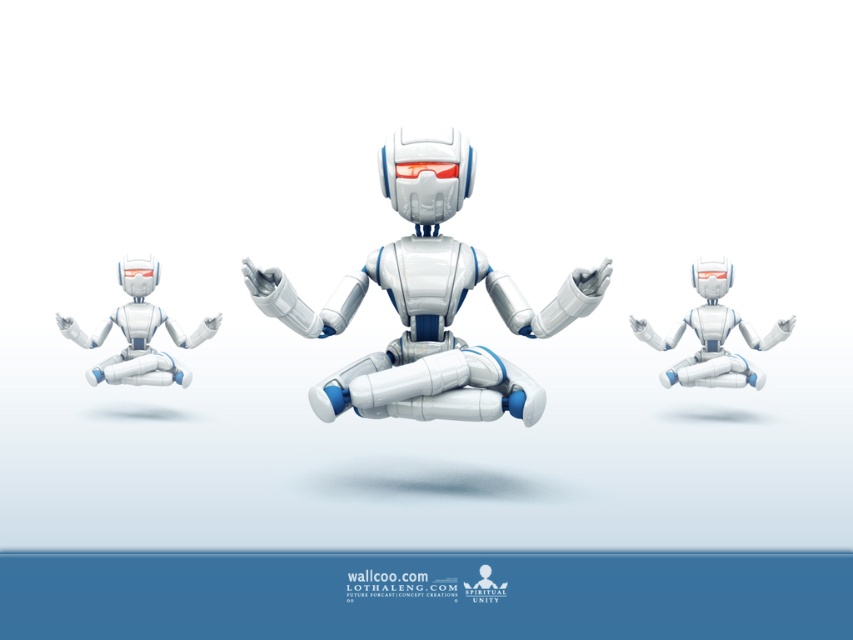
You are a technician inspecting the robots. You notice that the white matte robot at center and the white matte robot at left are supposed to be the same size. Based on the image, do you observe any discrepancy in their heights?

Yes, the white matte robot at center has a lesser height compared to the white matte robot at left, indicating a discrepancy in their sizes.

Based on the photo, you are a drone operator trying to navigate between two points in the image. The points are labeled as point (561, 298) and point (74, 337). Which point is closer to you?

Point (561, 298) is closer to the viewer than point (74, 337).

You are a photographer trying to capture a closeup of the central robot in the image. You notice two points of interest marked at coordinates point (503, 280) and point (761, 337). Which point should you focus on to ensure the central robot is in focus?

Point (503, 280) is closer to the camera than point (761, 337), so focusing on point (503, 280) will ensure the central robot is in focus.